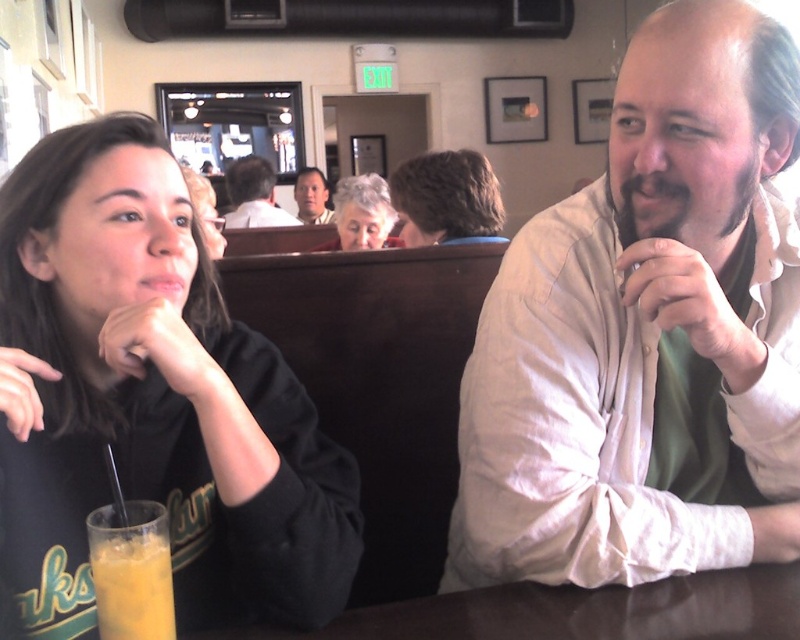
Which of these two, white cotton shirt at center or yellow frothy drink at lower left, stands taller?

white cotton shirt at center

Does white cotton shirt at center appear under yellow frothy drink at lower left?

No, white cotton shirt at center is not below yellow frothy drink at lower left.

Does point (612, 259) come closer to viewer compared to point (152, 550)?

No, it is not.

I want to click on white cotton shirt at center, so click(648, 332).

Image resolution: width=800 pixels, height=640 pixels. Identify the location of yellow frothy drink at lower left. (132, 570).

Can you confirm if yellow frothy drink at lower left is positioned below curly brown hair at center?

Indeed, yellow frothy drink at lower left is positioned under curly brown hair at center.

Where is `yellow frothy drink at lower left`? The image size is (800, 640). yellow frothy drink at lower left is located at coordinates (132, 570).

Which is more to the left, black matte shirt at left or matte black hair at upper center?

matte black hair at upper center

Describe the element at coordinates (150, 401) in the screenshot. The image size is (800, 640). I see `black matte shirt at left` at that location.

This screenshot has height=640, width=800. What do you see at coordinates (150, 401) in the screenshot?
I see `black matte shirt at left` at bounding box center [150, 401].

Image resolution: width=800 pixels, height=640 pixels. Find the location of `black matte shirt at left`. black matte shirt at left is located at coordinates (150, 401).